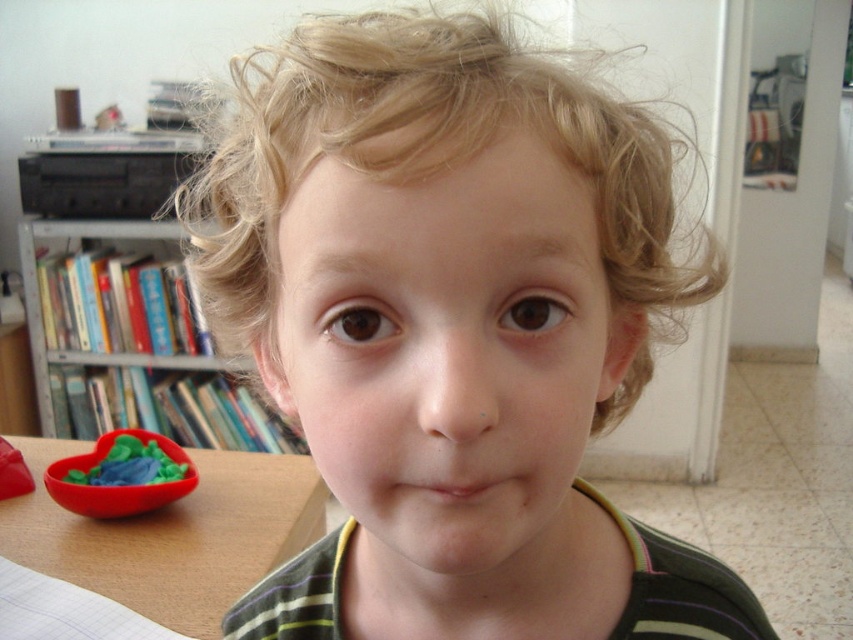
Question: Among these objects, which one is farthest from the camera?

Choices:
 (A) hardcover books at left
 (B) wooden table at lower left

Answer: (A)

Question: Where is smooth skin child at center located in relation to wooden table at lower left in the image?

Choices:
 (A) left
 (B) right

Answer: (B)

Question: Is wooden table at lower left bigger than rubber heart at lower left?

Choices:
 (A) no
 (B) yes

Answer: (B)

Question: Is smooth skin child at center in front of hardcover books at left?

Choices:
 (A) no
 (B) yes

Answer: (B)

Question: Which of the following is the closest to the observer?

Choices:
 (A) rubber heart at lower left
 (B) smooth skin child at center

Answer: (B)

Question: Which point appears farthest from the camera in this image?

Choices:
 (A) (61, 268)
 (B) (384, 145)
 (C) (102, 436)

Answer: (A)